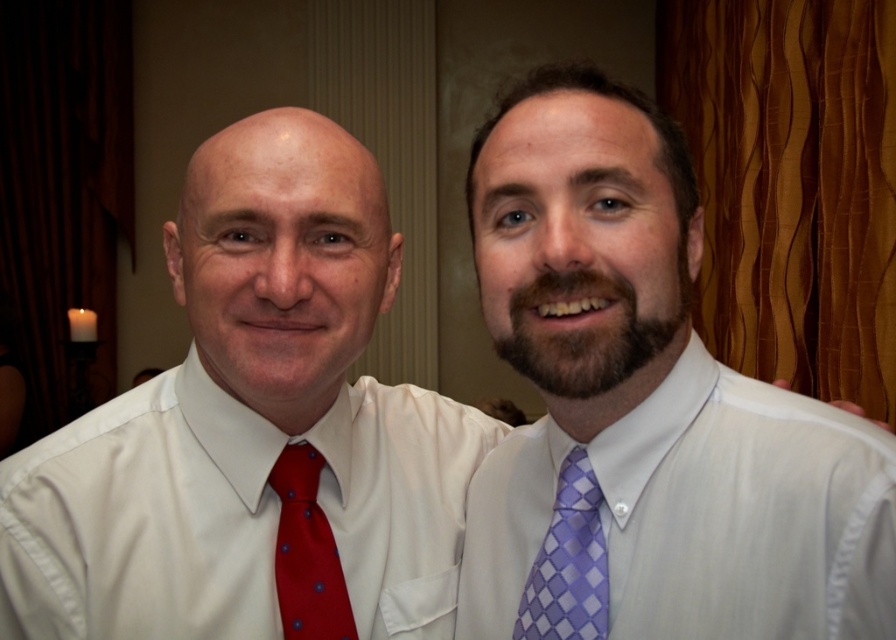
You are a photographer setting up a shot for two people. You have a white satin dress shirt at right and a purple checkered tie at center. Which object is positioned higher in the frame?

The white satin dress shirt at right is taller than the purple checkered tie at center, so the white satin dress shirt at right is positioned higher in the frame.

Looking at this image, you are a photographer adjusting the lighting for a portrait. You notice the matte white shirt at center and the polka dot silk tie at left. Which object should you focus the light on to ensure it stands out more due to its size?

The matte white shirt at center should be focused on because it has a larger size compared to the polka dot silk tie at left, making it more prominent.

You are a photographer setting up for a group photo. You have two subjects in front of you wearing a white satin dress shirt at right and a purple checkered tie at center. You need to position a microphone stand between them so that it doesn t block either of them. Based on their positions, which side of the microphone stand should you place closer to the narrower object to ensure proper spacing?

The white satin dress shirt at right might be wider than the purple checkered tie at center, so you should place the microphone stand closer to the purple checkered tie at center to accommodate the wider white satin dress shirt at right.